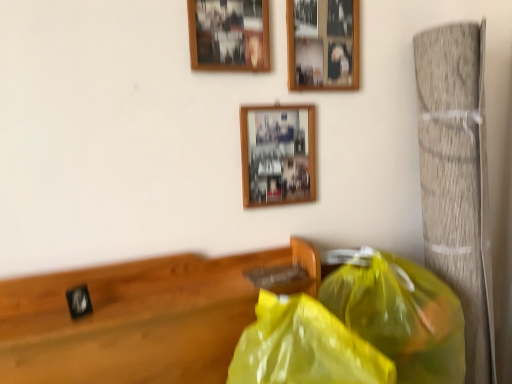
Question: Which direction should I rotate to face wooden picture frame at center, the 1th picture frame positioned from the bottom, — up or down?

Choices:
 (A) up
 (B) down

Answer: (A)

Question: Is wooden picture frame at center, which is the third picture frame from top to bottom, turned away from black matte clock at left?

Choices:
 (A) yes
 (B) no

Answer: (B)

Question: Does wooden picture frame at center, which is the third picture frame from top to bottom, come in front of black matte clock at left?

Choices:
 (A) no
 (B) yes

Answer: (A)

Question: From a real-world perspective, is wooden picture frame at center, the 1th picture frame positioned from the bottom, located higher than black matte clock at left?

Choices:
 (A) no
 (B) yes

Answer: (B)

Question: Is wooden picture frame at center, the 1th picture frame positioned from the bottom, at the right side of black matte clock at left?

Choices:
 (A) yes
 (B) no

Answer: (A)

Question: From a real-world perspective, is wooden picture frame at center, the 1th picture frame positioned from the bottom, positioned under black matte clock at left based on gravity?

Choices:
 (A) yes
 (B) no

Answer: (B)

Question: Can you confirm if wooden picture frame at center, the 1th picture frame positioned from the bottom, is wider than black matte clock at left?

Choices:
 (A) yes
 (B) no

Answer: (B)

Question: From a real-world perspective, is wooden picture frame at upper center, the first picture frame in the top-to-bottom sequence, under wooden photo frame at upper center, placed as the 2th picture frame when sorted from top to bottom?

Choices:
 (A) yes
 (B) no

Answer: (B)

Question: From the image's perspective, would you say wooden picture frame at upper center, the first picture frame in the top-to-bottom sequence, is positioned over wooden photo frame at upper center, placed as the 2th picture frame when sorted from top to bottom?

Choices:
 (A) no
 (B) yes

Answer: (B)

Question: Is wooden picture frame at upper center, the first picture frame in the top-to-bottom sequence, surrounding wooden photo frame at upper center, placed as the 2th picture frame when sorted from top to bottom?

Choices:
 (A) yes
 (B) no

Answer: (B)

Question: Considering the relative positions of wooden picture frame at upper center, the third picture frame from the bottom, and wooden photo frame at upper center, placed as the 2th picture frame when sorted from top to bottom, in the image provided, is wooden picture frame at upper center, the third picture frame from the bottom, to the left of wooden photo frame at upper center, placed as the 2th picture frame when sorted from top to bottom, from the viewer's perspective?

Choices:
 (A) no
 (B) yes

Answer: (B)

Question: Is the position of wooden picture frame at upper center, the first picture frame in the top-to-bottom sequence, less distant than that of wooden photo frame at upper center, placed as the second picture frame when sorted from bottom to top?

Choices:
 (A) no
 (B) yes

Answer: (B)

Question: Is wooden picture frame at upper center, the third picture frame from the bottom, turned away from wooden photo frame at upper center, placed as the 2th picture frame when sorted from top to bottom?

Choices:
 (A) yes
 (B) no

Answer: (B)

Question: Is yellow translucent plastic bag at lower right, placed as the 1th plastic bag when sorted from left to right, to the left of black matte clock at left from the viewer's perspective?

Choices:
 (A) no
 (B) yes

Answer: (A)